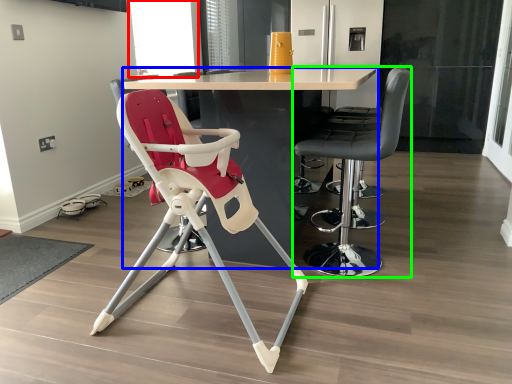
Question: Estimate the real-world distances between objects in this image. Which object is closer to window screen (highlighted by a red box), table (highlighted by a blue box) or chair (highlighted by a green box)?

Choices:
 (A) table
 (B) chair

Answer: (A)